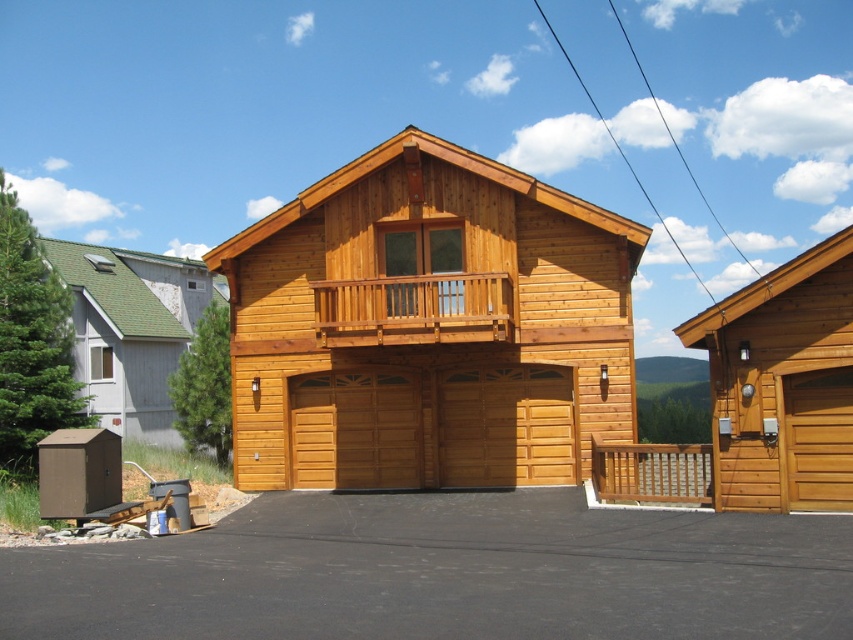
Is natural wood cabin at center further to camera compared to wooden cabin at right?

Yes, it is behind wooden cabin at right.

Is natural wood cabin at center positioned before wooden cabin at right?

That is False.

Does point (608, 381) lie behind point (848, 243)?

Yes, point (608, 381) is farther from viewer.

Identify the location of natural wood cabin at center. (428, 326).

Consider the image. Does wooden cabin at right appear on the right side of natural wood railing at center?

Yes, wooden cabin at right is to the right of natural wood railing at center.

Is wooden cabin at right smaller than natural wood railing at center?

Actually, wooden cabin at right might be larger than natural wood railing at center.

Does point (717, 378) come closer to viewer compared to point (332, 310)?

Yes, it is in front of point (332, 310).

Image resolution: width=853 pixels, height=640 pixels. Find the location of `wooden cabin at right`. wooden cabin at right is located at coordinates (782, 385).

Describe the element at coordinates (428, 326) in the screenshot. I see `natural wood cabin at center` at that location.

Is natural wood cabin at center in front of wooden garage door at center?

Yes.

Who is more forward, (473,189) or (518,483)?

Point (518,483) is more forward.

Where is `natural wood cabin at center`? natural wood cabin at center is located at coordinates (428, 326).